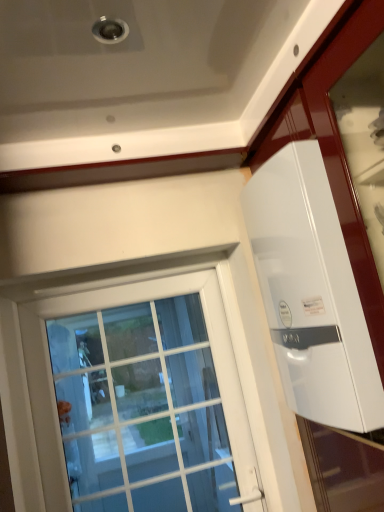
Question: Could you tell me if white glass window at center is turned towards white glossy water heater at upper right?

Choices:
 (A) no
 (B) yes

Answer: (A)

Question: Is white glass window at center oriented away from white glossy water heater at upper right?

Choices:
 (A) yes
 (B) no

Answer: (B)

Question: Is white glass window at center to the right of white glossy water heater at upper right from the viewer's perspective?

Choices:
 (A) yes
 (B) no

Answer: (B)

Question: From a real-world perspective, is white glass window at center on white glossy water heater at upper right?

Choices:
 (A) no
 (B) yes

Answer: (A)

Question: Considering the relative sizes of white glass window at center and white glossy water heater at upper right in the image provided, is white glass window at center taller than white glossy water heater at upper right?

Choices:
 (A) yes
 (B) no

Answer: (A)

Question: Does white glass window at center have a smaller size compared to white glossy water heater at upper right?

Choices:
 (A) yes
 (B) no

Answer: (A)

Question: From a real-world perspective, is white glossy water heater at upper right located higher than white glass window at center?

Choices:
 (A) yes
 (B) no

Answer: (A)

Question: From the image's perspective, is white glossy water heater at upper right above white glass window at center?

Choices:
 (A) yes
 (B) no

Answer: (A)

Question: Is white glossy water heater at upper right not near white glass window at center?

Choices:
 (A) yes
 (B) no

Answer: (A)

Question: Does white glossy water heater at upper right have a lesser width compared to white glass window at center?

Choices:
 (A) no
 (B) yes

Answer: (A)

Question: Is white glossy water heater at upper right touching white glass window at center?

Choices:
 (A) no
 (B) yes

Answer: (A)

Question: Is white glossy water heater at upper right bigger than white glass window at center?

Choices:
 (A) no
 (B) yes

Answer: (B)

Question: Choose the correct answer: Is white glossy water heater at upper right inside white glass window at center or outside it?

Choices:
 (A) inside
 (B) outside

Answer: (B)